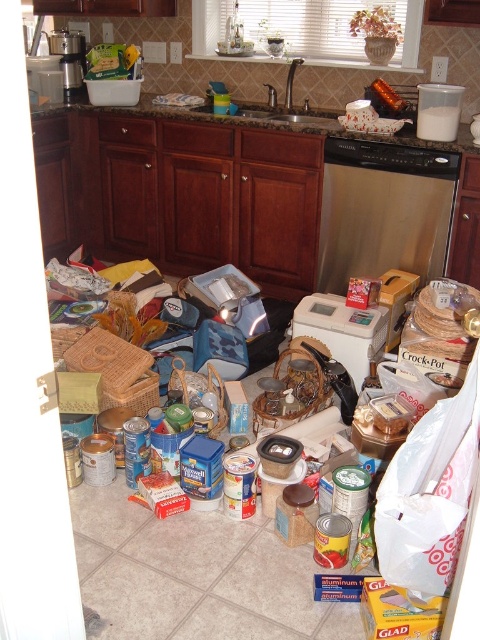
You are a delivery person who just arrived at the kitchen. You need to place a large box that is 1.5 meters long on the floor between the white plastic toaster at center and the satin nickel faucet at center. Is there enough space for the box?

The distance between the white plastic toaster at center and the satin nickel faucet at center is 1.27 meters. Since the box is 1.5 meters long, it will not fit in the available space.

You are trying to place a new microwave that is 12 inches wide on the kitchen counter. The counter has space between the white plastic toaster at center and the metallic coffee maker at upper left. Can the microwave fit in that space?

The white plastic toaster at center might be wider than the metallic coffee maker at upper left, so the space between them may not be wide enough for the microwave. Measure the exact width to confirm.

You are a delivery person who just entered the kitchen and need to place a large box between the satin nickel faucet at center and the metallic coffee maker at upper left. Can you fit the box there if it requires at least 4 feet of space?

The satin nickel faucet at center and metallic coffee maker at upper left are 3.97 feet apart. Since the required space is 4 feet, the box cannot be placed there as the available space is slightly less than needed.